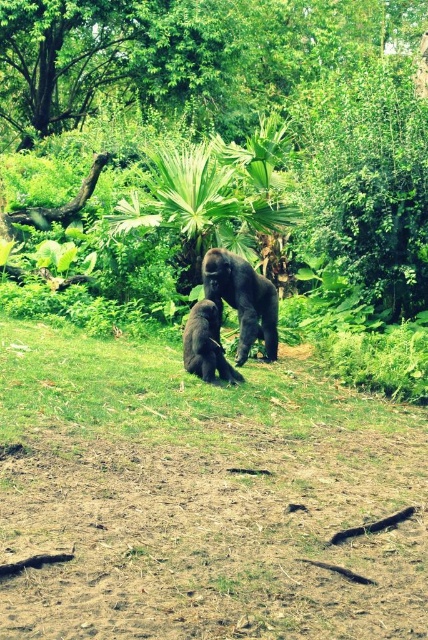
Question: Observing the image, what is the correct spatial positioning of shiny dark brown gorilla at center in reference to shiny black gorilla at center?

Choices:
 (A) below
 (B) above

Answer: (B)

Question: Based on their relative distances, which object is nearer to the green grass at center?

Choices:
 (A) shiny dark brown gorilla at center
 (B) shiny black gorilla at center
 (C) brown soil at center

Answer: (C)

Question: Is brown soil at center further to the viewer compared to shiny black gorilla at center?

Choices:
 (A) yes
 (B) no

Answer: (B)

Question: Estimate the real-world distances between objects in this image. Which object is closer to the green grass at center?

Choices:
 (A) shiny dark brown gorilla at center
 (B) brown soil at center

Answer: (B)

Question: Observing the image, what is the correct spatial positioning of green leafy tree at upper center in reference to green grass at center?

Choices:
 (A) above
 (B) below

Answer: (A)

Question: Which of the following is the farthest from the observer?

Choices:
 (A) shiny black gorilla at center
 (B) green leafy tree at upper center
 (C) brown soil at center

Answer: (B)